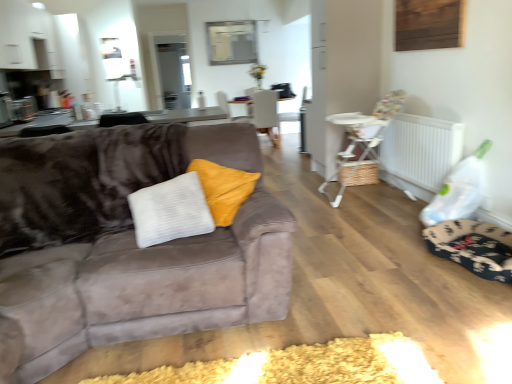
This screenshot has width=512, height=384. What do you see at coordinates (303, 120) in the screenshot?
I see `white fabric armchair at center` at bounding box center [303, 120].

Measure the distance between white plastic highchair at right, the 2th chair from the left, and camera.

The distance of white plastic highchair at right, the 2th chair from the left, from camera is 12.48 feet.

Describe the element at coordinates (421, 149) in the screenshot. I see `white plastic radiator at right` at that location.

What is the approximate width of white woven basket at center?

16.06 inches.

What do you see at coordinates (358, 148) in the screenshot? The height and width of the screenshot is (384, 512). I see `white woven basket at center` at bounding box center [358, 148].

Image resolution: width=512 pixels, height=384 pixels. Find the location of `matte gray chair at center, which is the 2th chair from front to back`. matte gray chair at center, which is the 2th chair from front to back is located at coordinates (266, 114).

Locate an element on the screen. white fabric armchair at center is located at coordinates (x=303, y=120).

In terms of height, does white plastic radiator at right look taller or shorter compared to suede couch at left?

white plastic radiator at right is shorter than suede couch at left.

The width and height of the screenshot is (512, 384). Find the location of `radiator lying above the suede couch at left (from the image's perspective)`. radiator lying above the suede couch at left (from the image's perspective) is located at coordinates (421, 149).

From a real-world perspective, does white plastic radiator at right sit lower than suede couch at left?

Yes, from a real-world perspective, white plastic radiator at right is below suede couch at left.

Which is behind, white plastic radiator at right or suede couch at left?

Positioned behind is white plastic radiator at right.

Considering the relative sizes of white woven basket at center and suede couch at left in the image provided, is white woven basket at center bigger than suede couch at left?

Incorrect, white woven basket at center is not larger than suede couch at left.

From the image's perspective, which one is positioned lower, white woven basket at center or suede couch at left?

suede couch at left, from the image's perspective.

Does point (346, 141) lie behind point (7, 354)?

Yes.

From the picture: Is suede couch at left at the back of white woven basket at center?

white woven basket at center does not have its back to suede couch at left.

Is white woven basket at center at the back of floral fabric dog bed at lower right?

No.

From the image's perspective, would you say floral fabric dog bed at lower right is positioned over white woven basket at center?

No.

Is floral fabric dog bed at lower right situated inside white woven basket at center or outside?

floral fabric dog bed at lower right is located beyond the bounds of white woven basket at center.

Considering the relative sizes of floral fabric dog bed at lower right and white woven basket at center in the image provided, is floral fabric dog bed at lower right smaller than white woven basket at center?

No, floral fabric dog bed at lower right is not smaller than white woven basket at center.

I want to click on studio couch on the left of matte gray chair at center, which is counted as the first chair, starting from the back, so click(146, 287).

Is matte gray chair at center, which is the 2th chair from front to back, touching suede couch at left?

No, matte gray chair at center, which is the 2th chair from front to back, is not next to suede couch at left.

From a real-world perspective, is matte gray chair at center, which is the first chair in left-to-right order, positioned above or below suede couch at left?

From a real-world perspective, matte gray chair at center, which is the first chair in left-to-right order, is physically below suede couch at left.

From the image's perspective, between matte gray chair at center, which is the 2th chair from front to back, and suede couch at left, who is located below?

suede couch at left, from the image's perspective.

From the image's perspective, is white plastic radiator at right below matte gray chair at center, which is the first chair in left-to-right order?

Indeed, from the image's perspective, white plastic radiator at right is shown beneath matte gray chair at center, which is the first chair in left-to-right order.

Considering the sizes of objects white plastic radiator at right and matte gray chair at center, which is the 2th chair from front to back, in the image provided, who is taller, white plastic radiator at right or matte gray chair at center, which is the 2th chair from front to back,?

matte gray chair at center, which is the 2th chair from front to back, is taller.

Which is less distant, (388, 157) or (257, 119)?

Clearly, point (388, 157) is closer to the camera than point (257, 119).

From the white plastic radiator at right, count 2nd chairs backward and point to it. Please provide its 2D coordinates.

[(266, 114)]

I want to click on armchair behind the white plastic radiator at right, so click(x=303, y=120).

Based on the photo, looking at their sizes, would you say white plastic radiator at right is wider or thinner than white fabric armchair at center?

Clearly, white plastic radiator at right has less width compared to white fabric armchair at center.

Is white fabric armchair at center at the back of white plastic radiator at right?

No, white plastic radiator at right's orientation is not away from white fabric armchair at center.

Is white plastic radiator at right touching white fabric armchair at center?

white plastic radiator at right and white fabric armchair at center are clearly separated.

Does point (302, 144) come farther from viewer compared to point (425, 170)?

Yes, point (302, 144) is farther from viewer.

Could white plastic radiator at right be considered to be inside white fabric armchair at center?

Definitely not — white plastic radiator at right is not inside white fabric armchair at center.

In terms of height, does white fabric armchair at center look taller or shorter compared to white plastic radiator at right?

In the image, white fabric armchair at center appears to be taller than white plastic radiator at right.

Could you tell me if white fabric armchair at center is turned towards white plastic radiator at right?

No, white fabric armchair at center is not oriented towards white plastic radiator at right.

There is a white plastic radiator at right. Where is `studio couch above it (from a real-world perspective)`? The width and height of the screenshot is (512, 384). studio couch above it (from a real-world perspective) is located at coordinates (146, 287).

Locate an element on the screen. This screenshot has height=384, width=512. studio couch located on the left of white woven basket at center is located at coordinates (146, 287).

Consider the image. Estimate the real-world distances between objects in this image. Which object is closer to white fabric armchair at center, floral fabric dog bed at lower right or matte gray chair at center, which is the first chair in left-to-right order?

matte gray chair at center, which is the first chair in left-to-right order, is positioned closer to the anchor white fabric armchair at center.

Considering their positions, is white plastic radiator at right positioned further to white woven basket at center than white plastic highchair at right, placed as the 1th chair when sorted from right to left?

white plastic radiator at right lies further to white woven basket at center than the other object.

From the image, which object appears to be nearer to white fabric armchair at center, suede couch at left or white plastic highchair at right, the 2th chair from the left?

Among the two, white plastic highchair at right, the 2th chair from the left, is located nearer to white fabric armchair at center.

From the image, which object appears to be farther from white plastic highchair at right, placed as the 1th chair when sorted from right to left, suede couch at left or white fabric armchair at center?

white fabric armchair at center is further to white plastic highchair at right, placed as the 1th chair when sorted from right to left.

Estimate the real-world distances between objects in this image. Which object is closer to matte gray chair at center, which is the 2th chair from front to back, white plastic radiator at right or white woven basket at center?

The object closer to matte gray chair at center, which is the 2th chair from front to back, is white woven basket at center.

Looking at the image, which one is located closer to white plastic highchair at right, placed as the 2th chair when sorted from back to front, floral fabric dog bed at lower right or matte gray chair at center, which is the first chair in left-to-right order?

The object closer to white plastic highchair at right, placed as the 2th chair when sorted from back to front, is floral fabric dog bed at lower right.

Looking at the image, which one is located further to matte gray chair at center, acting as the 2th chair starting from the right, white fabric armchair at center or white plastic radiator at right?

Based on the image, white plastic radiator at right appears to be further to matte gray chair at center, acting as the 2th chair starting from the right.

From the image, which object appears to be nearer to matte gray chair at center, which is the 2th chair from front to back, white fabric armchair at center or suede couch at left?

The object closer to matte gray chair at center, which is the 2th chair from front to back, is white fabric armchair at center.

This screenshot has width=512, height=384. I want to click on dog bed positioned between suede couch at left and matte gray chair at center, which is the first chair in left-to-right order, from near to far, so click(x=473, y=247).

Image resolution: width=512 pixels, height=384 pixels. Find the location of `chair located between suede couch at left and white woven basket at center in the depth direction`. chair located between suede couch at left and white woven basket at center in the depth direction is located at coordinates (362, 137).

Where is `chair located between floral fabric dog bed at lower right and matte gray chair at center, which is counted as the first chair, starting from the back, in the depth direction`? The height and width of the screenshot is (384, 512). chair located between floral fabric dog bed at lower right and matte gray chair at center, which is counted as the first chair, starting from the back, in the depth direction is located at coordinates (362, 137).

Where is `chair between floral fabric dog bed at lower right and white woven basket at center from front to back`? The image size is (512, 384). chair between floral fabric dog bed at lower right and white woven basket at center from front to back is located at coordinates (362, 137).